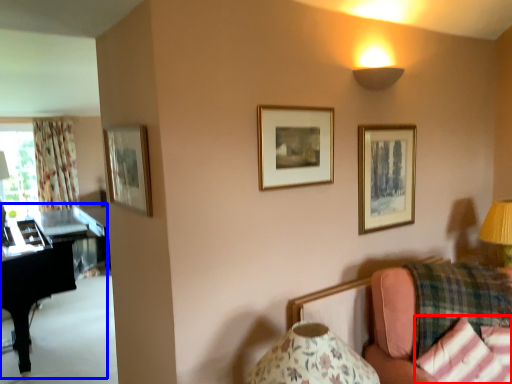
Question: Which object appears farthest to the camera in this image, pillow (highlighted by a red box) or piano (highlighted by a blue box)?

Choices:
 (A) pillow
 (B) piano

Answer: (B)